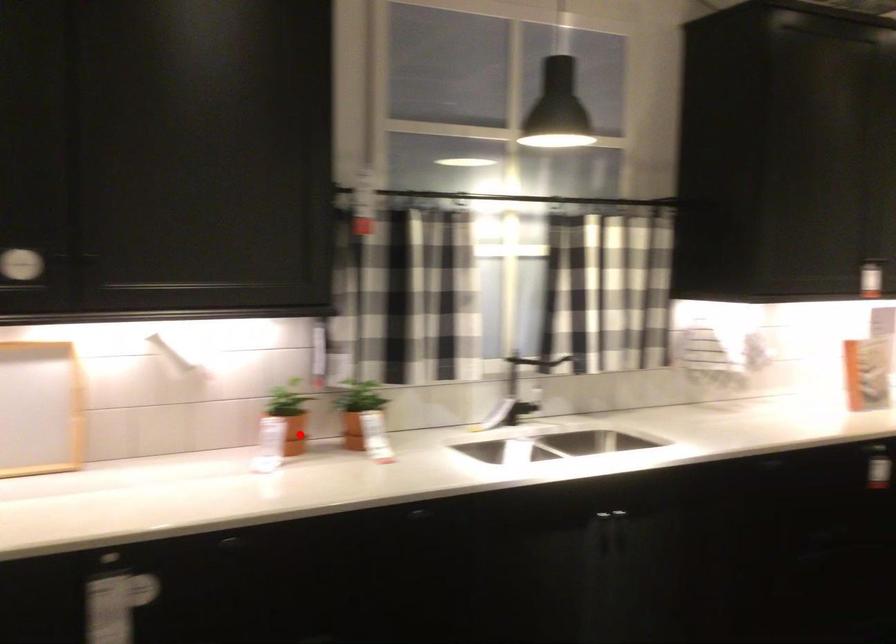
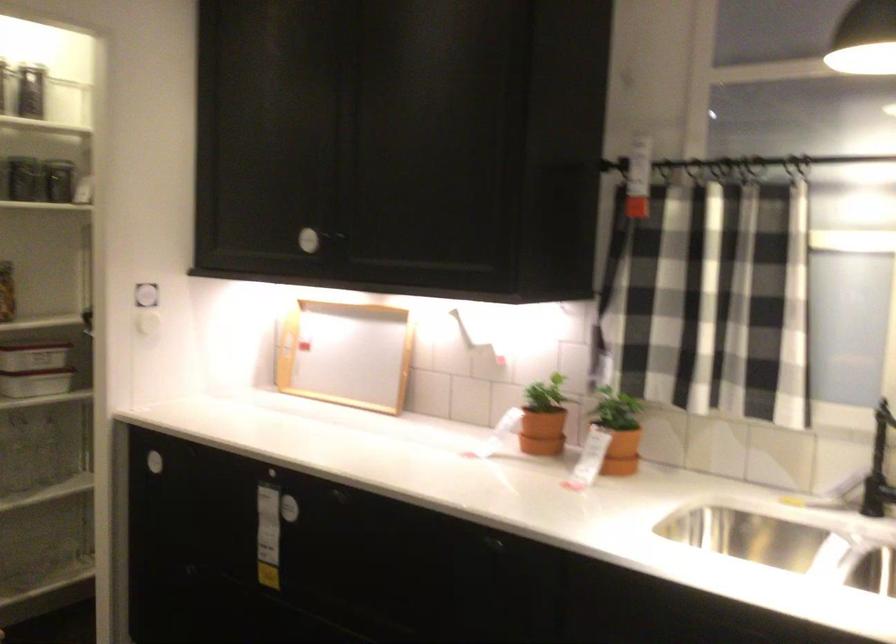
The point at the highlighted location is marked in the first image. Where is the corresponding point in the second image?

(541, 431)